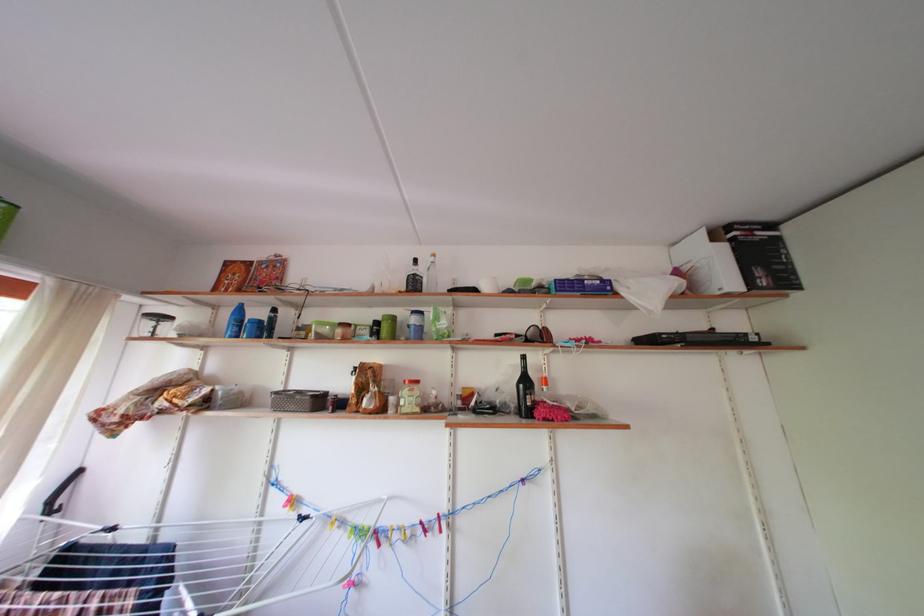
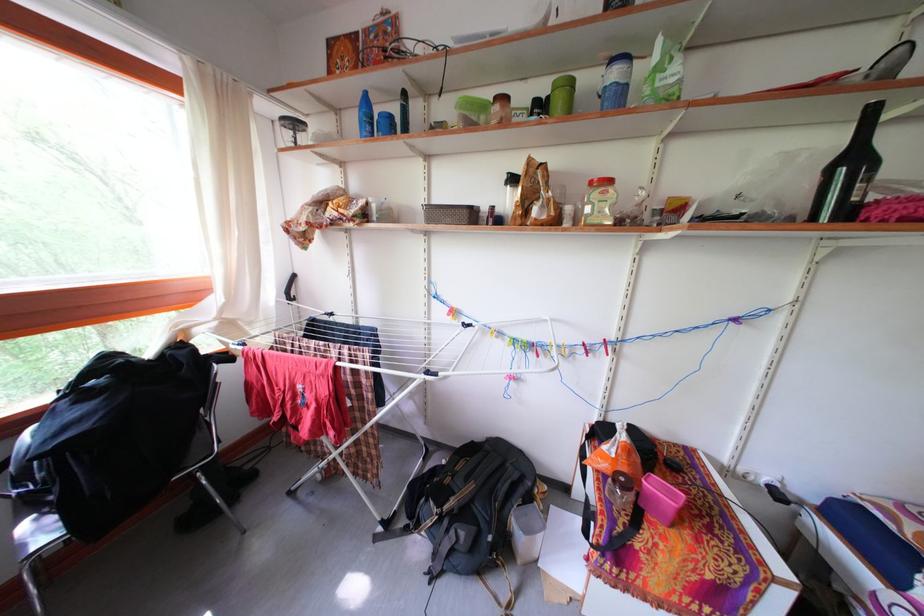
Based on the continuous images, in which direction is the camera rotating?

The camera's rotation is toward left-down.